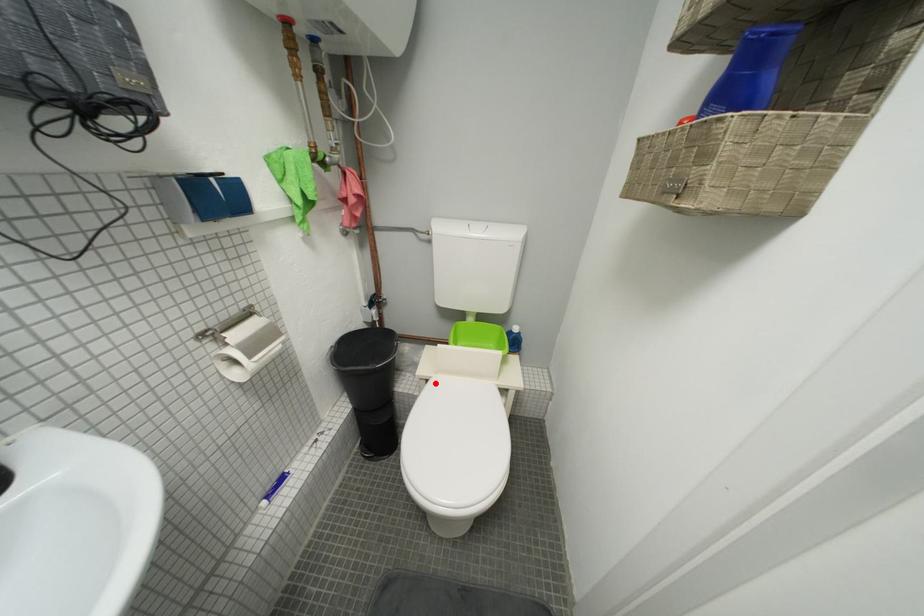
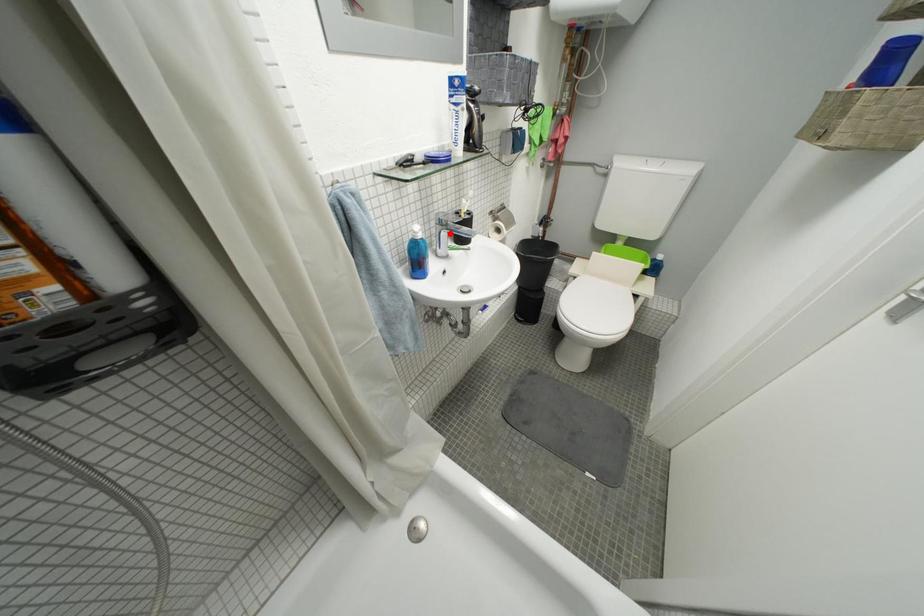
I am providing you with two images of the same scene from different viewpoints. A red point is marked on the first image and another point is marked on the second image. Does the point marked in image1 correspond to the same location as the one in image2?

No